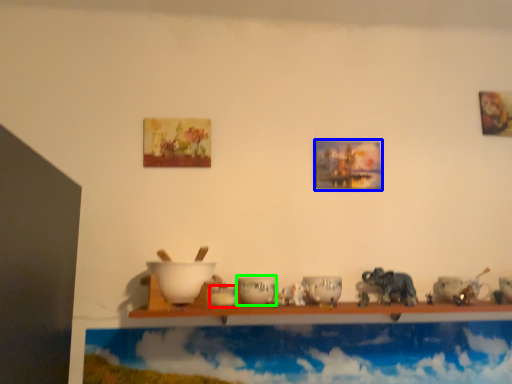
Question: Considering the real-world distances, which object is closest to tableware (highlighted by a red box)? picture frame (highlighted by a blue box) or tableware (highlighted by a green box).

Choices:
 (A) picture frame
 (B) tableware

Answer: (B)